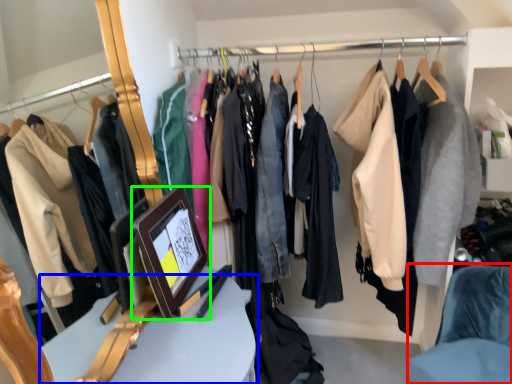
Question: Which object is positioned farthest from chair (highlighted by a red box)? Select from furniture (highlighted by a blue box) and picture frame (highlighted by a green box).

Choices:
 (A) furniture
 (B) picture frame

Answer: (B)